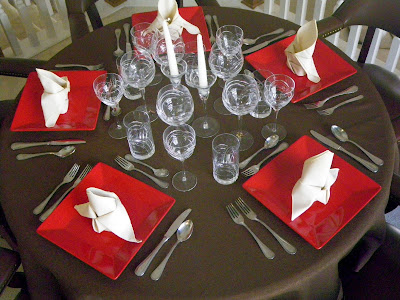
The width and height of the screenshot is (400, 300). I want to click on red dinner plates, so click(119, 259), click(85, 118), click(197, 17), click(336, 71), click(342, 206).